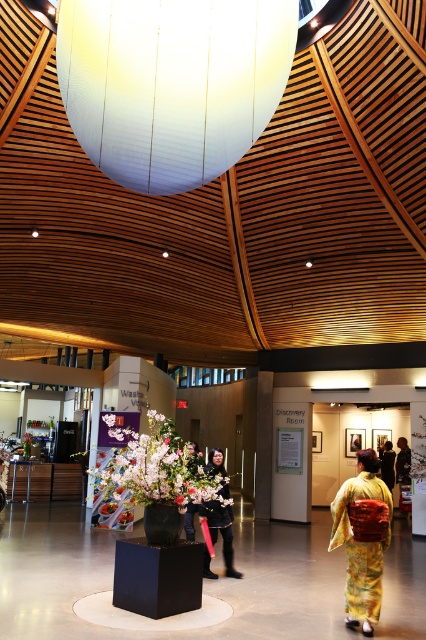
You are organizing a fashion show and need to display both the yellow silk kimono at center and the silky kimono at center on adjacent mannequins. Given their sizes, which kimono requires a larger display area?

The silky kimono at center requires a larger display area because it occupies more space than the yellow silk kimono at center.

You are standing in the modern building and see both the black fabric jacket at center and the silky kimono at center. Which one is positioned more to the right side?

The black fabric jacket at center is positioned to the right of the silky kimono at center, so it is more to the right.

You are a store manager arranging items in the center of the store. You have a black fabric jacket at center and a silky kimono at center. Which item should you place on a shelf that requires taller items to be placed at the back for visibility?

The silky kimono at center is taller than the black fabric jacket at center, so you should place the silky kimono at center at the back to ensure visibility.